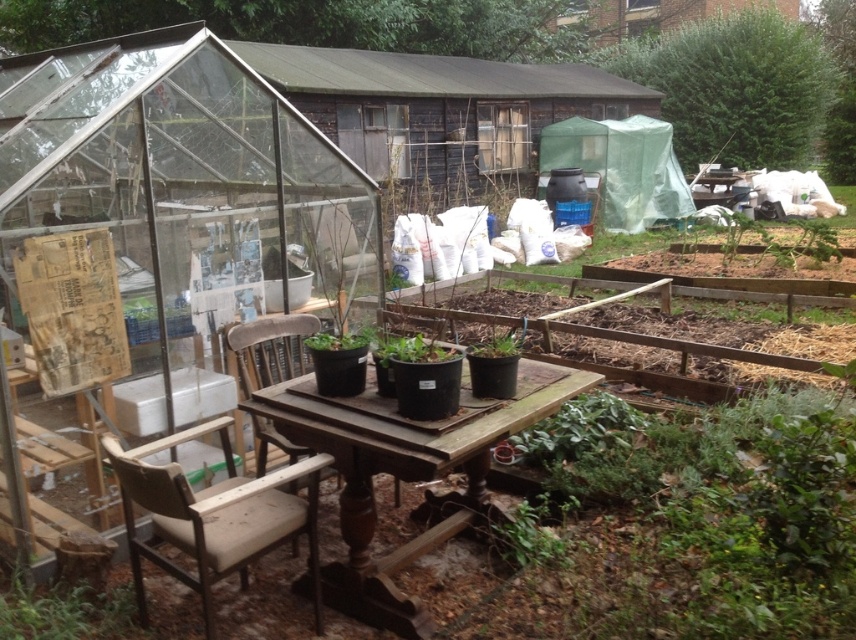
You are a gardener who wants to place a new plant on the wooden table. The new plant is as wide as the green matte pot at center. Will the green matte plant at lower left fit on the table without overlapping if placed next to the new plant?

The green matte plant at lower left is wider than the green matte pot at center. Since the new plant is the same width as the green matte pot at center, placing them side by side would require space accommodating the wider plant. Therefore, there might not be enough space unless the table is sufficiently large. However, the scene description mentions the table has several potted plants already, so overlapping could occur.

Consider the image. You are planning to place a beige fabric chair at lower left next to the green matte pot at center. Based on their widths, will the chair take up more space horizontally than the pot?

The beige fabric chair at lower left might be wider than green matte pot at center, so it could take up more horizontal space.

You are a gardener who needs to place a new tool on the wooden table at center. However, there is already a green matte pot at center on it. Can you place the tool on the table without moving the pot?

The wooden table at center is much taller than the green matte pot at center, so there is enough space to place the tool on the table alongside the green matte pot at center without moving it.